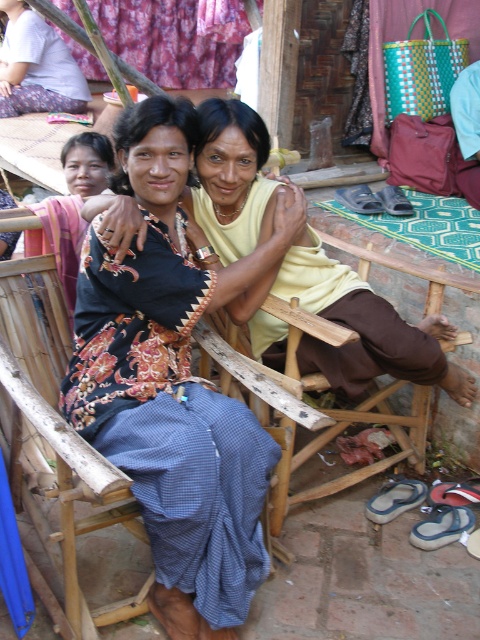
You are standing at the origin point in the image. Which direction should you move to reach the bamboo chair at left?

The bamboo chair at left is located at point 0.727 on the x axis and 0.138 on the y axis. Since you are at the origin point, you should move towards the right and slightly downward to reach it.

You are a photographer trying to capture a closeup of the printed cotton shirt at center and the wooden chair at center. Which object is located more to the left in the frame?

The printed cotton shirt at center is positioned on the left side of the wooden chair at center, so it is more to the left.

From the picture: You are trying to decide whether to place a new decorative item between the printed cotton shirt at center and the bamboo chair at left. Based on their sizes, can you determine which side has more space available for placement?

The printed cotton shirt at center has a larger width than the bamboo chair at left, so there is more space available on the side of the bamboo chair at left for placing the decorative item.